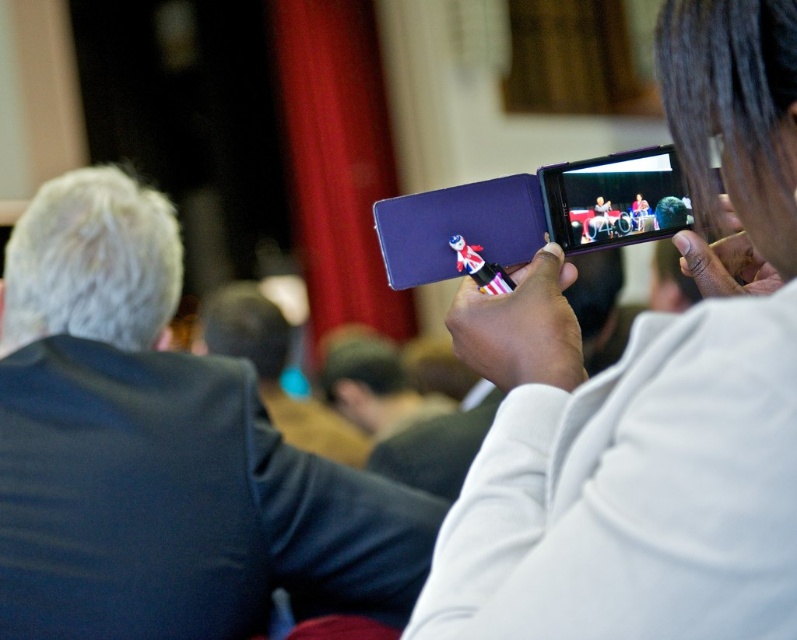
You are attending an event and want to take a photo of the dark blue suit at left. Where should you aim your camera?

You should aim your camera at point [159,451] to capture the dark blue suit at left.

You are attending an event and see the dark blue suit at left and the matte purple phone at upper right. Which object is closer to the bottom of the image?

The dark blue suit at left is closer to the bottom of the image because it is positioned under the matte purple phone at upper right.

You are attending an event and notice the matte purple phone at upper right and the dark brown leather jacket at center. Which object is taller when comparing their heights?

The dark brown leather jacket at center is taller than the matte purple phone at upper right.